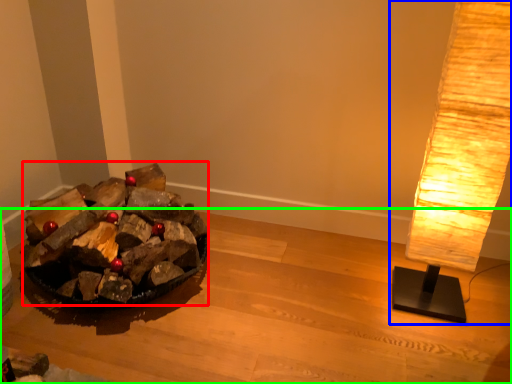
Question: Based on their relative distances, which object is nearer to debris (highlighted by a red box)? Choose from lamp (highlighted by a blue box) and furniture (highlighted by a green box).

Choices:
 (A) lamp
 (B) furniture

Answer: (B)